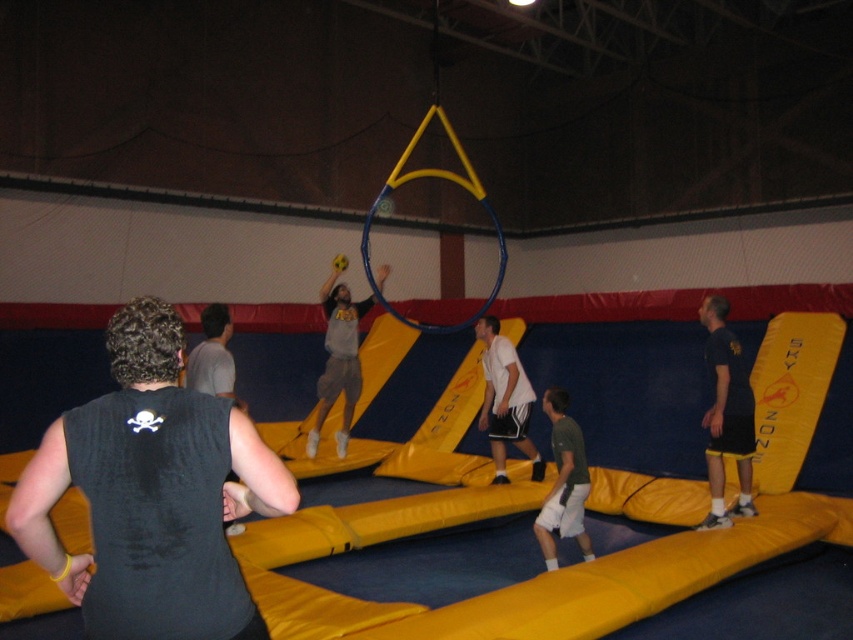
Question: Does white matte shorts at center have a lesser width compared to gray fabric shirt at left?

Choices:
 (A) yes
 (B) no

Answer: (A)

Question: Among these points, which one is nearest to the camera?

Choices:
 (A) (552, 516)
 (B) (337, 451)
 (C) (531, 465)
 (D) (173, 353)

Answer: (D)

Question: Which object is closer to the camera taking this photo?

Choices:
 (A) gray fabric shirt at center
 (B) white matte shorts at center

Answer: (B)

Question: Does black sleeveless shirt at center appear over gray fabric shirt at center?

Choices:
 (A) yes
 (B) no

Answer: (B)

Question: Does black sleeveless shirt at center have a larger size compared to gray fabric shirt at left?

Choices:
 (A) yes
 (B) no

Answer: (B)

Question: Among these points, which one is nearest to the camera?

Choices:
 (A) (157, 384)
 (B) (512, 422)
 (C) (543, 557)
 (D) (186, 364)

Answer: (A)